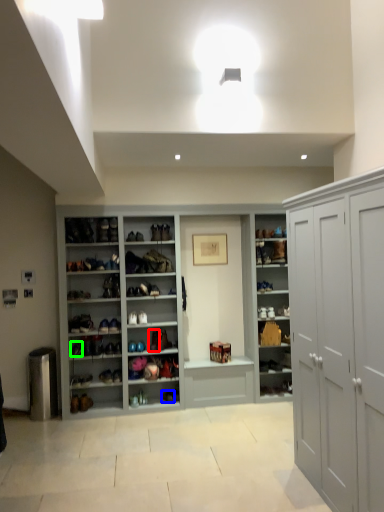
Question: Based on their relative distances, which object is farther from shoe (highlighted by a red box)? Choose from shoe (highlighted by a blue box) and shoe (highlighted by a green box).

Choices:
 (A) shoe
 (B) shoe

Answer: (B)